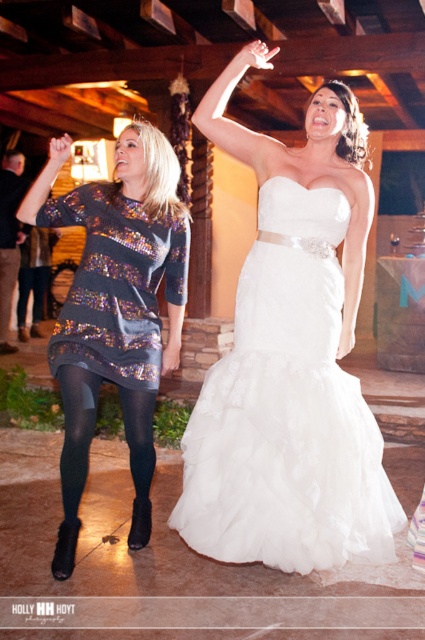
Is point (90, 268) closer to viewer compared to point (147, 424)?

Yes, point (90, 268) is in front of point (147, 424).

Can you confirm if sparkly sequin dress at left is wider than black tights at lower left?

Indeed, sparkly sequin dress at left has a greater width compared to black tights at lower left.

Which is in front, point (104, 336) or point (76, 458)?

Point (76, 458) is in front.

Identify the location of sparkly sequin dress at left. This screenshot has width=425, height=640. (115, 308).

Is white satin dress at center taller than black tights at lower left?

Correct, white satin dress at center is much taller as black tights at lower left.

Is white satin dress at center positioned before black tights at lower left?

Yes.

Where is `white satin dress at center`? white satin dress at center is located at coordinates (289, 364).

Does white satin dress at center appear over sparkly sequin dress at left?

Yes.

Which is more to the left, white satin dress at center or sparkly sequin dress at left?

From the viewer's perspective, sparkly sequin dress at left appears more on the left side.

Locate an element on the screen. This screenshot has height=640, width=425. white satin dress at center is located at coordinates (289, 364).

Identify the location of white satin dress at center. (289, 364).